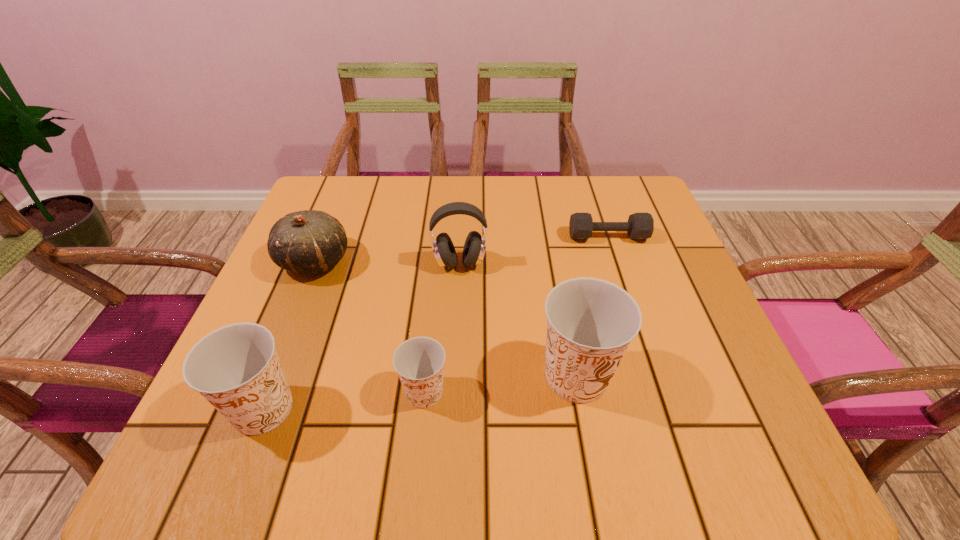
Locate an element on the screen. Image resolution: width=960 pixels, height=540 pixels. the leftmost Dixie cup is located at coordinates (236, 368).

Image resolution: width=960 pixels, height=540 pixels. I want to click on the shortest Dixie cup, so click(419, 361).

Where is `the second Dixie cup from right to left`? Image resolution: width=960 pixels, height=540 pixels. the second Dixie cup from right to left is located at coordinates (419, 361).

Identify the location of the rightmost Dixie cup. The height and width of the screenshot is (540, 960). (590, 323).

Where is `gourd`? This screenshot has height=540, width=960. gourd is located at coordinates (309, 242).

This screenshot has width=960, height=540. Find the location of `the shortest object`. the shortest object is located at coordinates (640, 226).

This screenshot has height=540, width=960. Identify the location of headset. (444, 251).

You are a GUI agent. You are given a task and a screenshot of the screen. Output one action in this format:
    pyautogui.click(x=<x>, y=<y>)
    Task: Click on the vacant position located on the back of the leftmost Dixie cup
    This screenshot has width=960, height=540.
    Given the screenshot: What is the action you would take?
    pyautogui.click(x=330, y=237)

Identify the location of vacant area situated 0.340m on the back of the fifth tallest object. This screenshot has height=540, width=960. (439, 249).

Find the location of a particular element. The image size is (960, 540). vacant space located on the left of the rightmost Dixie cup is located at coordinates (385, 376).